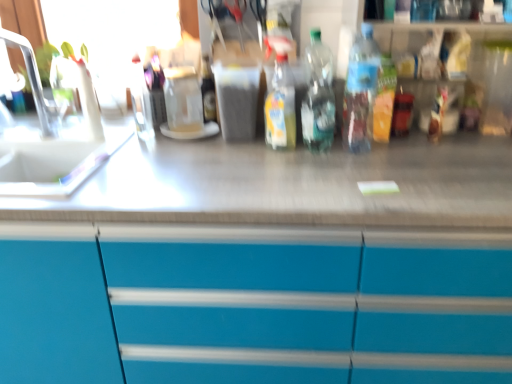
Where is `vacant space to the right of translucent plastic bottle at center, which is the 2th bottle from left to right`? vacant space to the right of translucent plastic bottle at center, which is the 2th bottle from left to right is located at coordinates (341, 153).